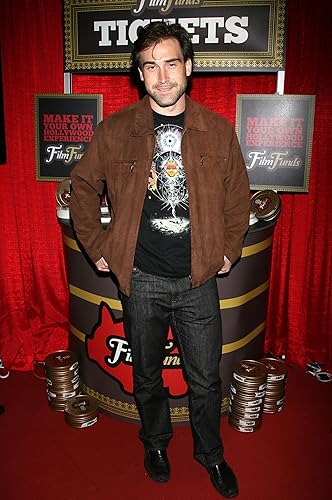
You are a GUI agent. You are given a task and a screenshot of the screen. Output one action in this format:
    pyautogui.click(x=<x>, y=<y>)
    Task: Click on the red carpet
    The width and height of the screenshot is (332, 500).
    Given the screenshot: What is the action you would take?
    pyautogui.click(x=74, y=459)